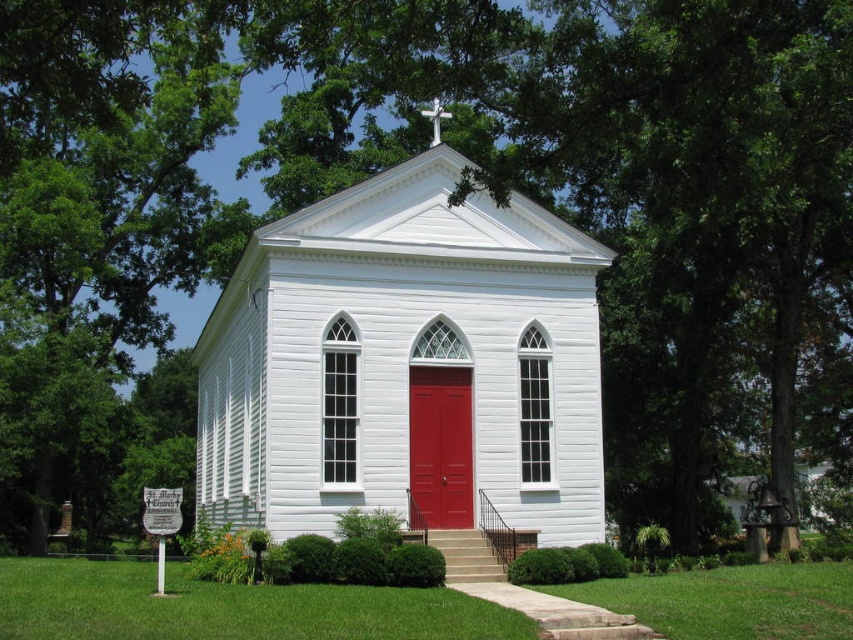
You are a visitor approaching the white wood chapel at center and notice the matte wood door at center. Which object would appear larger in your field of view as you walk towards the chapel?

The white wood chapel at center would appear larger in your field of view as you walk towards it because it is wider than the matte wood door at center.

You are a visitor approaching the white wood chapel at center. You notice the matte wood door at center. Which object is larger in size?

The white wood chapel at center is bigger than the matte wood door at center.